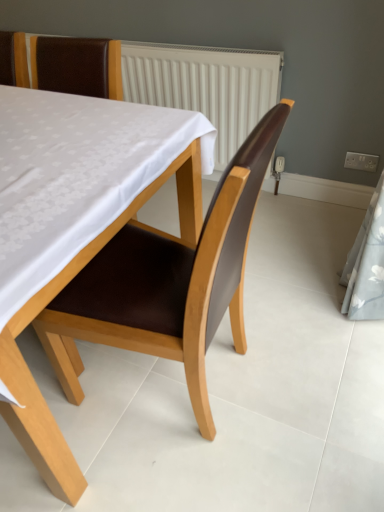
Question: Do you think brown leather chair at upper left, acting as the second chair starting from the bottom, is within brown leather chair at center, the 1th chair ordered from the bottom, or outside of it?

Choices:
 (A) inside
 (B) outside

Answer: (B)

Question: In terms of width, does brown leather chair at upper left, which is the 1th chair from top to bottom, look wider or thinner when compared to brown leather chair at center, the 1th chair ordered from the bottom?

Choices:
 (A) wide
 (B) thin

Answer: (B)

Question: Visually, is brown leather chair at upper left, which is the 1th chair from top to bottom, positioned to the left or to the right of brown leather chair at center, marked as the 2th chair in a top-to-bottom arrangement?

Choices:
 (A) left
 (B) right

Answer: (A)

Question: Looking at their shapes, would you say brown leather chair at center, marked as the 2th chair in a top-to-bottom arrangement, is wider or thinner than brown leather chair at upper left, which is the 1th chair from top to bottom?

Choices:
 (A) wide
 (B) thin

Answer: (A)

Question: Would you say brown leather chair at center, marked as the 2th chair in a top-to-bottom arrangement, is to the left or to the right of brown leather chair at upper left, acting as the second chair starting from the bottom, in the picture?

Choices:
 (A) left
 (B) right

Answer: (B)

Question: Which is correct: brown leather chair at center, the 1th chair ordered from the bottom, is inside brown leather chair at upper left, which is the 1th chair from top to bottom, or outside of it?

Choices:
 (A) inside
 (B) outside

Answer: (B)

Question: From their relative heights in the image, would you say brown leather chair at center, the 1th chair ordered from the bottom, is taller or shorter than brown leather chair at upper left, acting as the second chair starting from the bottom?

Choices:
 (A) tall
 (B) short

Answer: (A)